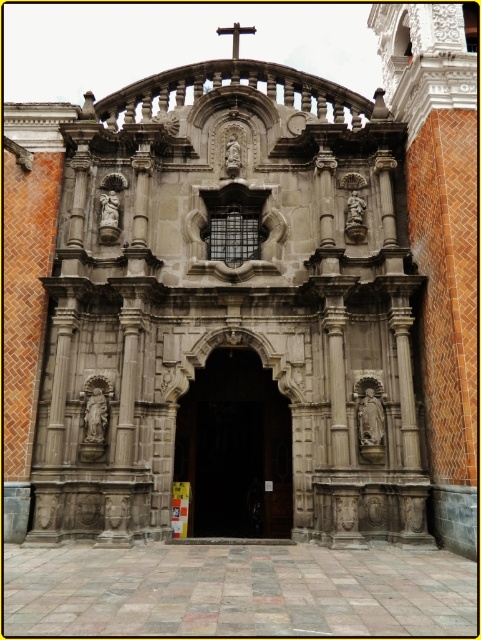
Based on the photo, is dark wood door at center smaller than wooden cross at center?

Incorrect, dark wood door at center is not smaller in size than wooden cross at center.

Is point (202, 528) closer to camera compared to point (232, 36)?

Yes, it is in front of point (232, 36).

Which is in front, point (252, 444) or point (253, 33)?

Point (252, 444) is in front.

You are a GUI agent. You are given a task and a screenshot of the screen. Output one action in this format:
    pyautogui.click(x=<x>, y=<y>)
    Task: Click on the dark wood door at center
    This screenshot has width=481, height=640.
    Given the screenshot: What is the action you would take?
    coord(235,449)